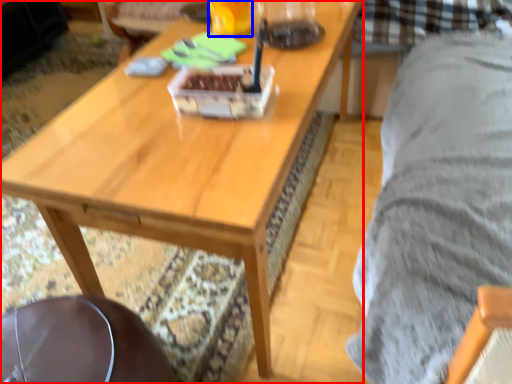
Question: Which of the following is the farthest to the observer, coffee table (highlighted by a red box) or beverage (highlighted by a blue box)?

Choices:
 (A) coffee table
 (B) beverage

Answer: (B)